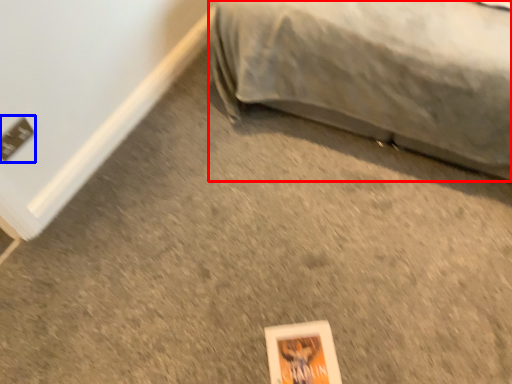
Question: Which object is further to the camera taking this photo, furniture (highlighted by a red box) or electric outlet (highlighted by a blue box)?

Choices:
 (A) furniture
 (B) electric outlet

Answer: (B)